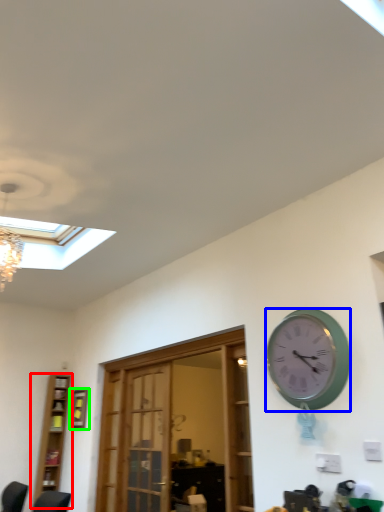
Question: Estimate the real-world distances between objects in this image. Which object is farther from bookshelf (highlighted by a red box), wall clock (highlighted by a blue box) or picture frame (highlighted by a green box)?

Choices:
 (A) wall clock
 (B) picture frame

Answer: (A)